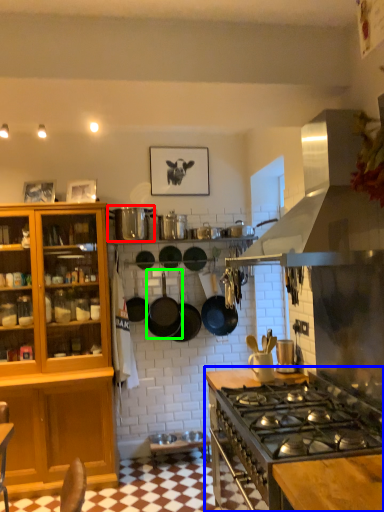
Question: Which object is the farthest from appliance (highlighted by a red box)? Choose among these: countertop (highlighted by a blue box) or wok (highlighted by a green box).

Choices:
 (A) countertop
 (B) wok

Answer: (A)